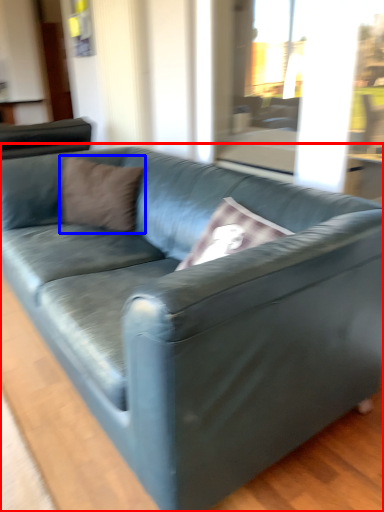
Question: Among these objects, which one is nearest to the camera, studio couch (highlighted by a red box) or pillow (highlighted by a blue box)?

Choices:
 (A) studio couch
 (B) pillow

Answer: (A)